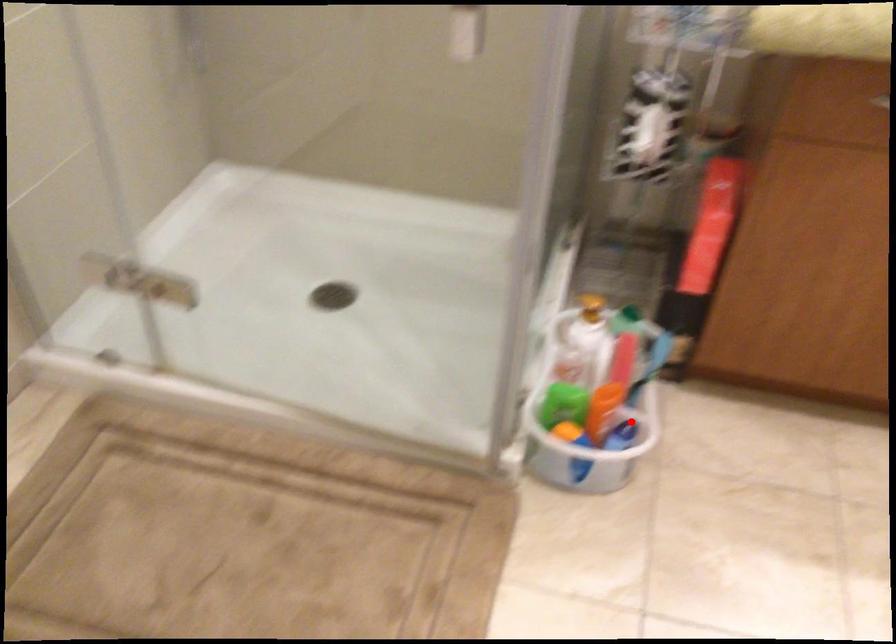
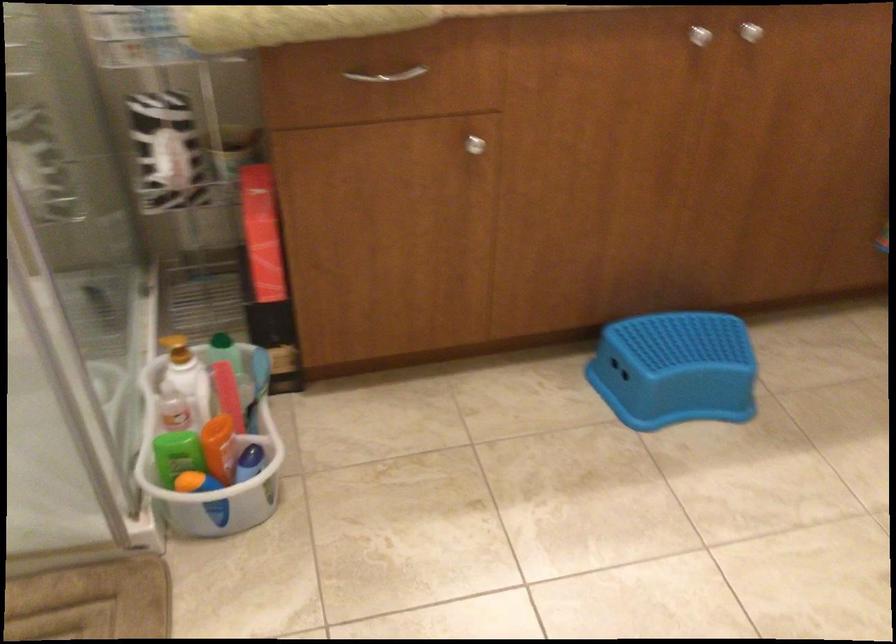
Locate, in the second image, the point that corresponds to the highlighted location in the first image.

(255, 451)